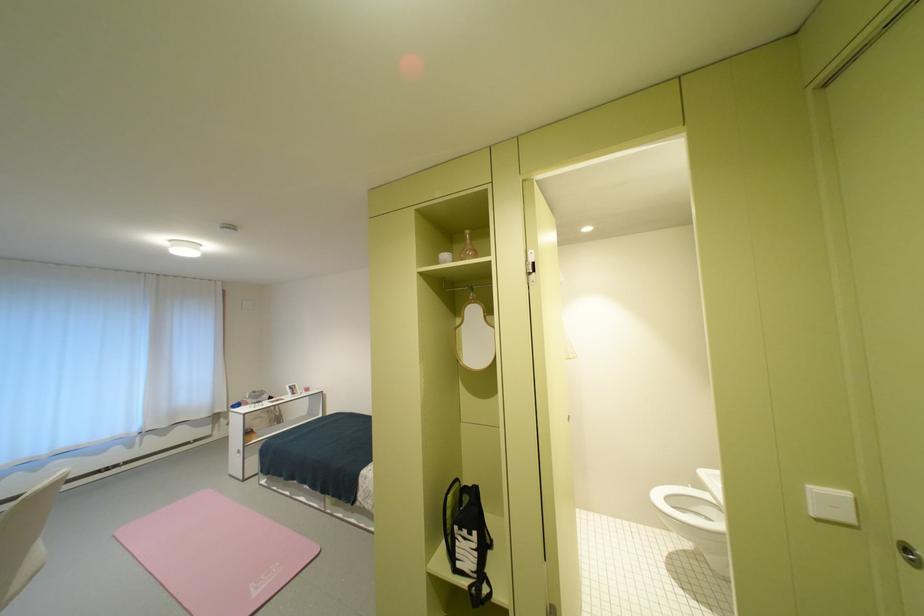
What do you see at coordinates (215, 554) in the screenshot? I see `the pink yoga mat` at bounding box center [215, 554].